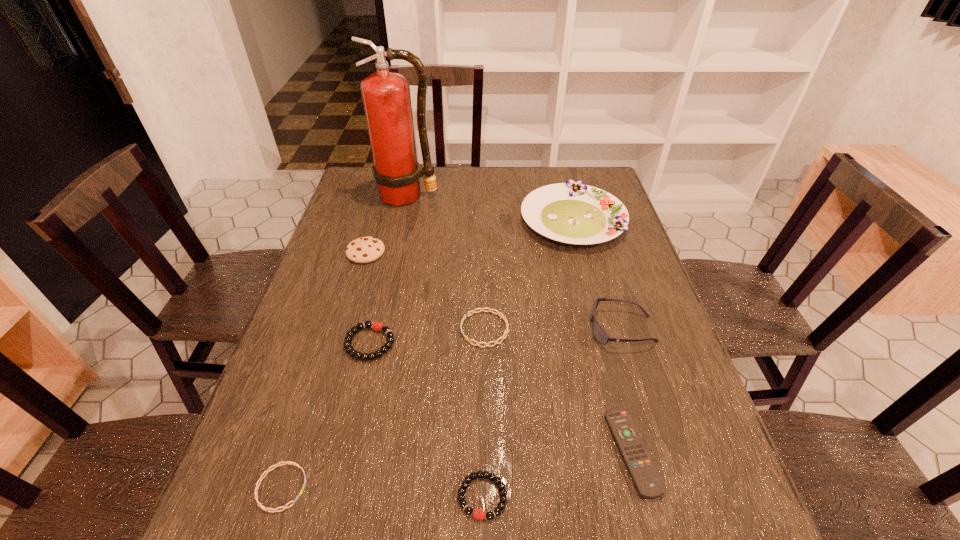
Where is `free space between the smaller black bracelet and the red fire extinguisher`? This screenshot has width=960, height=540. free space between the smaller black bracelet and the red fire extinguisher is located at coordinates (444, 346).

Where is `vacant point located between the smaller blue bracelet and the cookie`? This screenshot has width=960, height=540. vacant point located between the smaller blue bracelet and the cookie is located at coordinates (324, 370).

Find the location of a particular element. The width and height of the screenshot is (960, 540). object that stands as the third closest to the fire extinguisher is located at coordinates [481, 309].

Locate which object ranks in proximity to the remote control. Please provide its 2D coordinates. Your answer should be formatted as a tuple, i.e. [(x, y)], where the tuple contains the x and y coordinates of a point satisfying the conditions above.

[(600, 335)]

Locate an element on the screen. bracelet that is the closest to the nearer blue bracelet is located at coordinates (377, 326).

Select which bracelet is the closest to the fire extinguisher. Please provide its 2D coordinates. Your answer should be formatted as a tuple, i.e. [(x, y)], where the tuple contains the x and y coordinates of a point satisfying the conditions above.

[(481, 309)]

You are a GUI agent. You are given a task and a screenshot of the screen. Output one action in this format:
    pyautogui.click(x=<x>, y=<y>)
    Task: Click on the vacant area in the image that satisfies the following two spatial constraints: 1. at the nozzle of the tallest object; 2. on the right side of the nearer black bracelet
    This screenshot has width=960, height=540.
    Given the screenshot: What is the action you would take?
    pyautogui.click(x=342, y=496)

I want to click on vacant region that satisfies the following two spatial constraints: 1. on the surface of the farther blue bracelet showing star-shaped elements; 2. on the left side of the remote control, so click(486, 452).